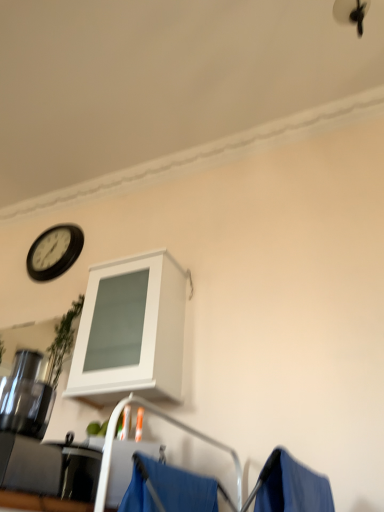
Question: Considering the relative sizes of blue fabric at lower center and white matte cabinet at upper center in the image provided, is blue fabric at lower center shorter than white matte cabinet at upper center?

Choices:
 (A) no
 (B) yes

Answer: (B)

Question: Is blue fabric at lower center at the right side of white matte cabinet at upper center?

Choices:
 (A) no
 (B) yes

Answer: (B)

Question: Is blue fabric at lower center aimed at white matte cabinet at upper center?

Choices:
 (A) no
 (B) yes

Answer: (A)

Question: Is blue fabric at lower center turned away from white matte cabinet at upper center?

Choices:
 (A) yes
 (B) no

Answer: (B)

Question: From a real-world perspective, is blue fabric at lower center under white matte cabinet at upper center?

Choices:
 (A) no
 (B) yes

Answer: (B)

Question: In the image, is black plastic clock at upper left positioned in front of or behind white matte cabinet at upper center?

Choices:
 (A) behind
 (B) front

Answer: (A)

Question: Considering the positions of black plastic clock at upper left and white matte cabinet at upper center in the image, is black plastic clock at upper left bigger or smaller than white matte cabinet at upper center?

Choices:
 (A) small
 (B) big

Answer: (A)

Question: From the image's perspective, is black plastic clock at upper left above or below white matte cabinet at upper center?

Choices:
 (A) above
 (B) below

Answer: (A)

Question: Considering the positions of black plastic clock at upper left and white matte cabinet at upper center in the image, is black plastic clock at upper left wider or thinner than white matte cabinet at upper center?

Choices:
 (A) wide
 (B) thin

Answer: (B)

Question: Considering the positions of black plastic clock at upper left and blue fabric at lower center in the image, is black plastic clock at upper left taller or shorter than blue fabric at lower center?

Choices:
 (A) short
 (B) tall

Answer: (B)

Question: Considering the positions of point [29, 254] and point [188, 510], is point [29, 254] closer or farther from the camera than point [188, 510]?

Choices:
 (A) closer
 (B) farther

Answer: (B)

Question: Is black plastic clock at upper left bigger or smaller than blue fabric at lower center?

Choices:
 (A) big
 (B) small

Answer: (A)

Question: Considering their positions, is black plastic clock at upper left located in front of or behind blue fabric at lower center?

Choices:
 (A) behind
 (B) front

Answer: (A)

Question: Does point (187, 484) appear closer or farther from the camera than point (56, 266)?

Choices:
 (A) closer
 (B) farther

Answer: (A)

Question: Is blue fabric at lower center spatially inside black plastic clock at upper left, or outside of it?

Choices:
 (A) outside
 (B) inside

Answer: (A)